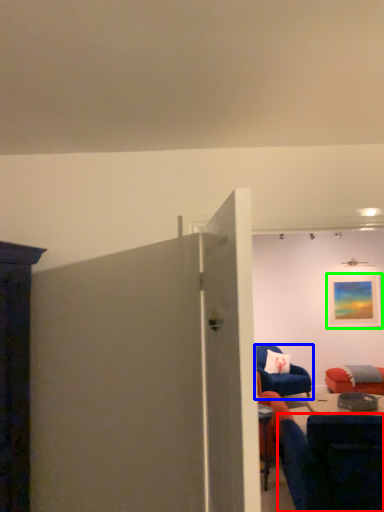
Question: Estimate the real-world distances between objects in this image. Which object is closer to chair (highlighted by a red box), chair (highlighted by a blue box) or picture frame (highlighted by a green box)?

Choices:
 (A) chair
 (B) picture frame

Answer: (A)